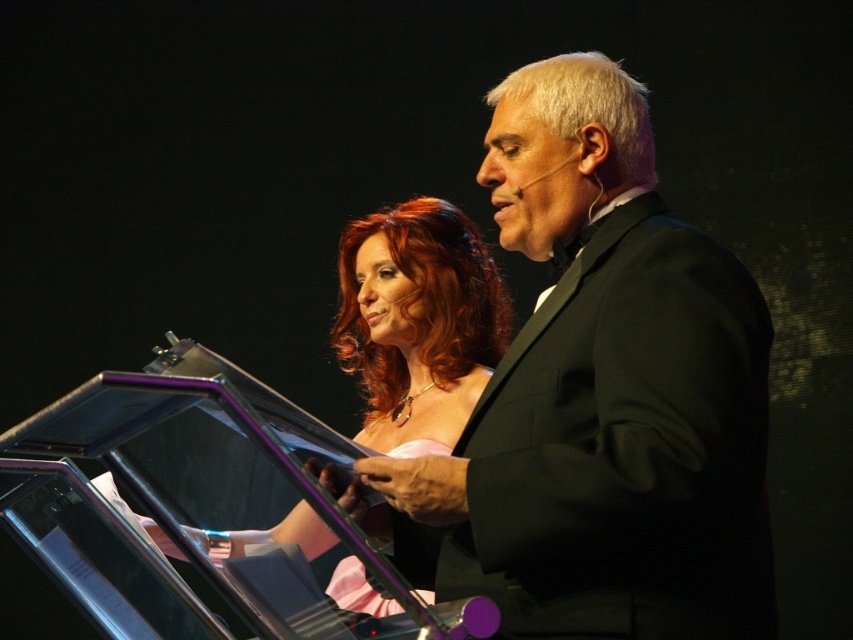
Who is more distant from viewer, [699,260] or [416,330]?

The point [416,330] is more distant.

Where is `black satin suit at center`? black satin suit at center is located at coordinates pyautogui.click(x=602, y=396).